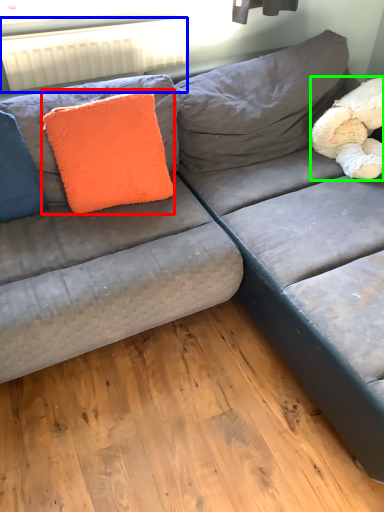
Question: Which is farther away from throw pillow (highlighted by a red box)? radiator (highlighted by a blue box) or teddy (highlighted by a green box)?

Choices:
 (A) radiator
 (B) teddy

Answer: (B)